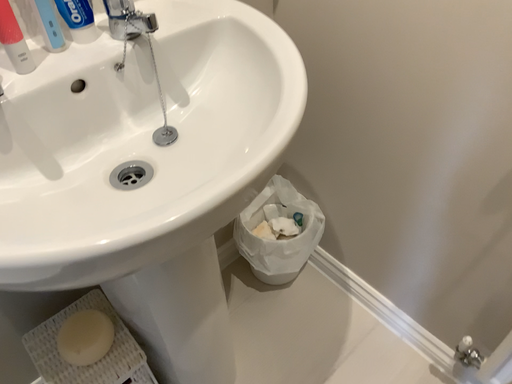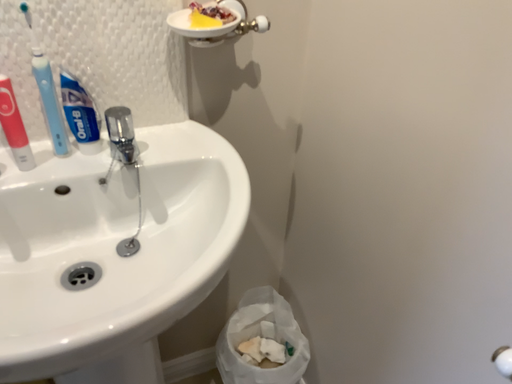
Question: Which way did the camera rotate in the video?

Choices:
 (A) rotated downward
 (B) rotated upward

Answer: (B)